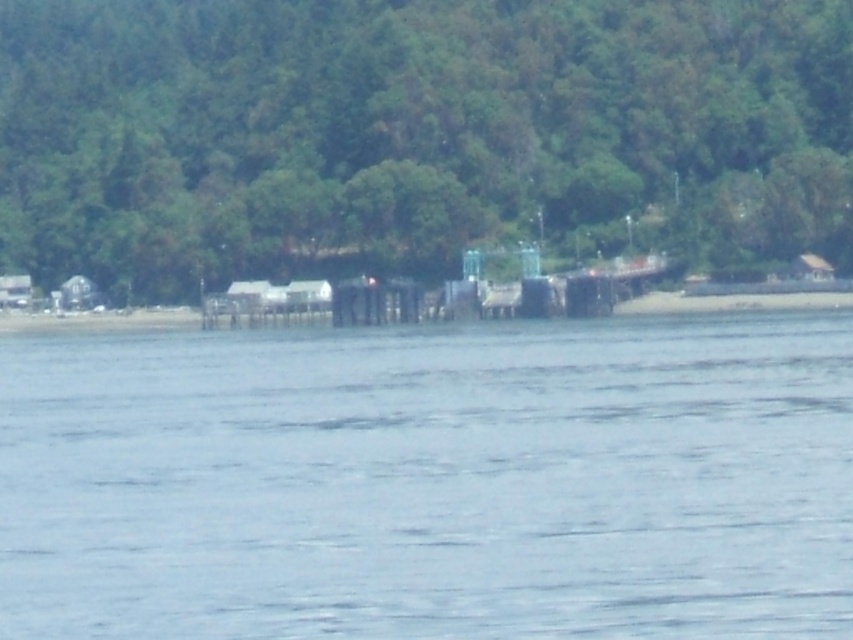
Question: Can you confirm if green leafy tree at center is bigger than wooden pier at center?

Choices:
 (A) no
 (B) yes

Answer: (B)

Question: From the image, what is the correct spatial relationship of clear water at center in relation to wooden pier at center?

Choices:
 (A) above
 (B) below

Answer: (B)

Question: Which of the following is the closest to the observer?

Choices:
 (A) wooden pier at center
 (B) green leafy tree at center
 (C) clear water at center

Answer: (C)

Question: Which point is farther from the camera taking this photo?

Choices:
 (A) (207, 310)
 (B) (67, 474)
 (C) (735, 10)

Answer: (C)

Question: Is clear water at center bigger than green leafy tree at center?

Choices:
 (A) yes
 (B) no

Answer: (B)

Question: Estimate the real-world distances between objects in this image. Which object is farther from the wooden pier at center?

Choices:
 (A) clear water at center
 (B) green leafy tree at center

Answer: (A)